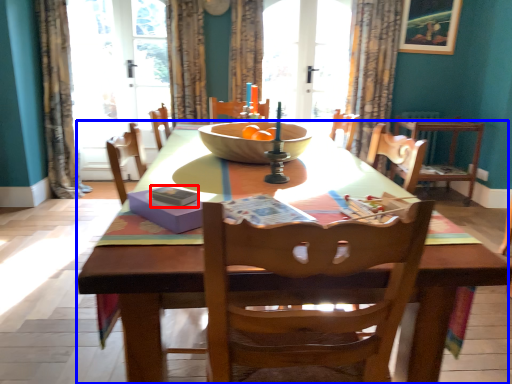
Question: Which point is further to the camera, magazine (highlighted by a red box) or kitchen & dining room table (highlighted by a blue box)?

Choices:
 (A) magazine
 (B) kitchen & dining room table

Answer: (A)